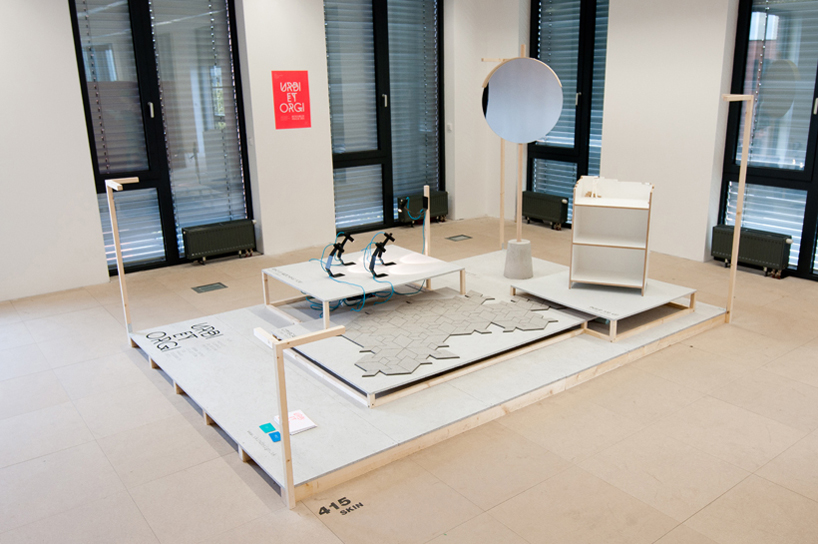
Find the location of a particular element. The height and width of the screenshot is (544, 818). table legs is located at coordinates (326, 307), (263, 284), (461, 282), (428, 283).